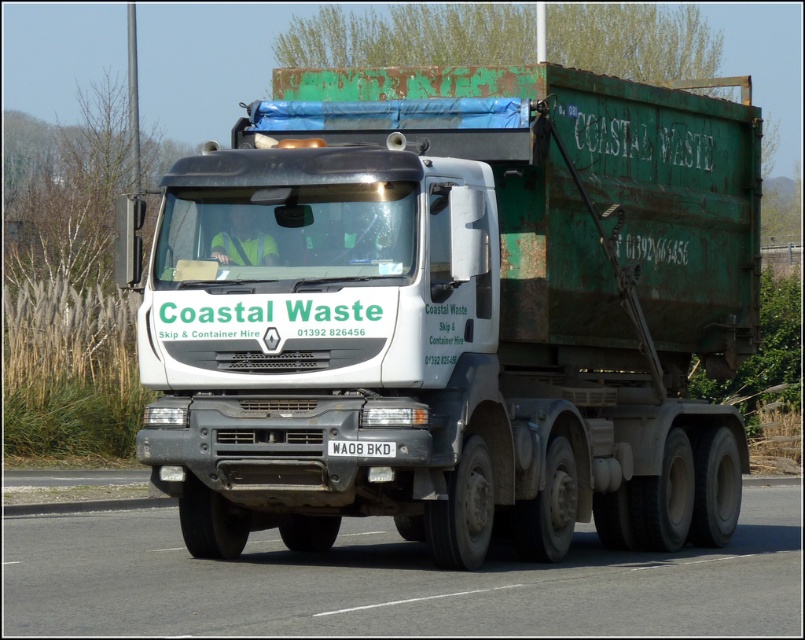
You are a pedestrian standing on the gray asphalt road at center. You see the white matte truck at center approaching from the distance. Which side of the road should you stand on to stay safe?

The white matte truck at center is positioned on the left side of gray asphalt road at center, so you should stand on the right side of the gray asphalt road at center to stay safe.

You are a delivery driver approaching the gray asphalt road at center and the white rectangular at center. Which one is closer to you as you drive forward?

The gray asphalt road at center is closer to you because it is in front of the white rectangular at center.

You are a delivery driver who needs to park your vehicle behind the white matte truck at center without blocking the white rectangular at center. According to the scene description, where should you position your vehicle?

The white matte truck at center is positioned over the white rectangular at center. To park behind the white matte truck at center without blocking the white rectangular at center, you should position your vehicle behind the white matte truck at center so that it doesn not cover the white rectangular at center.